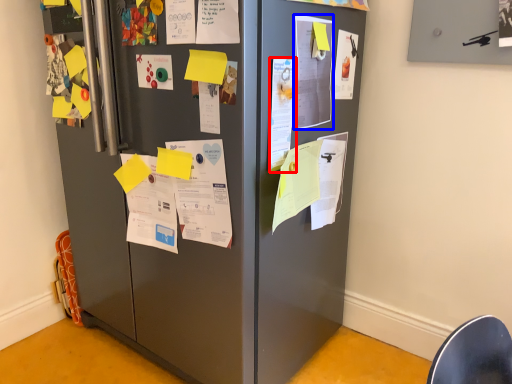
Question: Among these objects, which one is farthest to the camera, poster (highlighted by a red box) or poster (highlighted by a blue box)?

Choices:
 (A) poster
 (B) poster

Answer: (B)